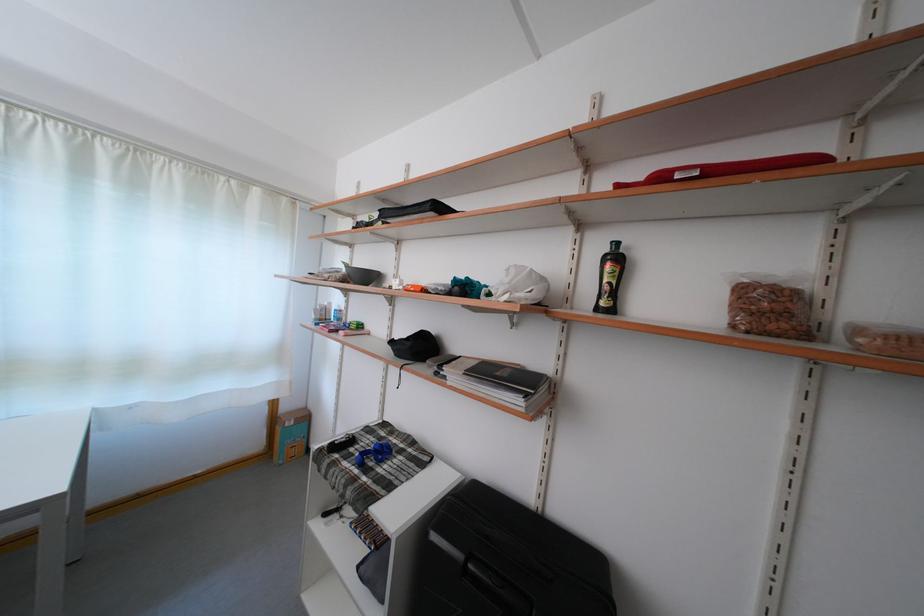
Where is `black plastic bottle`? This screenshot has height=616, width=924. black plastic bottle is located at coordinates (610, 278).